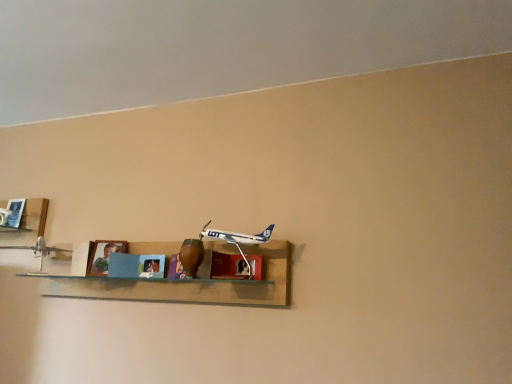
Question: Does wooden shelf at center, the first shelf viewed from the right, have a greater height compared to white plastic airplane at center, arranged as the 2th toy when viewed from the back?

Choices:
 (A) no
 (B) yes

Answer: (B)

Question: From the image's perspective, is wooden shelf at center, the second shelf viewed from the left, located above white plastic airplane at center, acting as the 1th toy starting from the right?

Choices:
 (A) yes
 (B) no

Answer: (B)

Question: Considering the relative sizes of wooden shelf at center, the second shelf viewed from the left, and white plastic airplane at center, arranged as the 2th toy when viewed from the back, in the image provided, is wooden shelf at center, the second shelf viewed from the left, wider than white plastic airplane at center, arranged as the 2th toy when viewed from the back,?

Choices:
 (A) yes
 (B) no

Answer: (A)

Question: From the image's perspective, does wooden shelf at center, the second shelf viewed from the left, appear lower than white plastic airplane at center, acting as the 1th toy starting from the front?

Choices:
 (A) no
 (B) yes

Answer: (B)

Question: Is wooden shelf at center, the second shelf viewed from the left, bigger than white plastic airplane at center, the second toy when ordered from left to right?

Choices:
 (A) no
 (B) yes

Answer: (B)

Question: Is white plastic airplane at center, the second toy when ordered from left to right, inside the boundaries of wooden shelf at center, the second shelf viewed from the left, or outside?

Choices:
 (A) inside
 (B) outside

Answer: (A)

Question: From the image's perspective, is white plastic airplane at center, acting as the 1th toy starting from the right, positioned above or below wooden shelf at center, the first shelf viewed from the right?

Choices:
 (A) below
 (B) above

Answer: (B)

Question: From their relative heights in the image, would you say white plastic airplane at center, acting as the 1th toy starting from the front, is taller or shorter than wooden shelf at center, the first shelf viewed from the right?

Choices:
 (A) short
 (B) tall

Answer: (A)

Question: From a real-world perspective, is white plastic airplane at center, arranged as the 2th toy when viewed from the back, physically located above or below wooden shelf at center, the second shelf viewed from the left?

Choices:
 (A) above
 (B) below

Answer: (A)

Question: Looking at the image, does blue matte picture frame at center seem bigger or smaller compared to matte wood cabinet at center?

Choices:
 (A) big
 (B) small

Answer: (A)

Question: In terms of width, does blue matte picture frame at center look wider or thinner when compared to matte wood cabinet at center?

Choices:
 (A) thin
 (B) wide

Answer: (A)

Question: From the image's perspective, is blue matte picture frame at center positioned above or below matte wood cabinet at center?

Choices:
 (A) below
 (B) above

Answer: (A)

Question: In terms of height, does blue matte picture frame at center look taller or shorter compared to matte wood cabinet at center?

Choices:
 (A) short
 (B) tall

Answer: (B)

Question: From the image's perspective, is matte wood cabinet at center positioned above or below metallic silver airplane at left, the 1th toy positioned from the back?

Choices:
 (A) below
 (B) above

Answer: (B)

Question: Is point (219, 263) closer or farther from the camera than point (40, 246)?

Choices:
 (A) closer
 (B) farther

Answer: (A)